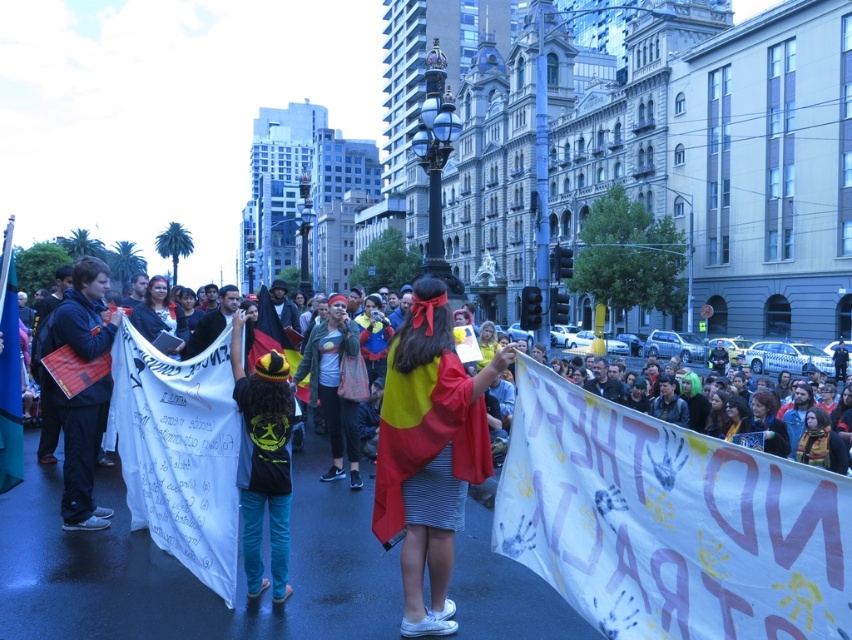
Does black matte t-shirt at center have a greater width compared to dark blue jacket at left?

Incorrect, black matte t-shirt at center's width does not surpass dark blue jacket at left's.

Image resolution: width=852 pixels, height=640 pixels. Identify the location of black matte t-shirt at center. (263, 461).

Which is behind, point (246, 572) or point (83, 504)?

The point (83, 504) is behind.

Identify the location of black matte t-shirt at center. (263, 461).

This screenshot has height=640, width=852. Describe the element at coordinates (82, 452) in the screenshot. I see `dark blue jacket at left` at that location.

Is point (73, 417) positioned before point (320, 337)?

Yes.

Which is in front, point (104, 346) or point (346, 346)?

Point (104, 346) is more forward.

Locate an element on the screen. The height and width of the screenshot is (640, 852). dark blue jacket at left is located at coordinates (82, 452).

Does red/yellow fabric at center appear over black matte t-shirt at center?

No, red/yellow fabric at center is not above black matte t-shirt at center.

Is point (413, 472) closer to camera compared to point (281, 600)?

No, (413, 472) is behind (281, 600).

What do you see at coordinates (429, 452) in the screenshot? This screenshot has width=852, height=640. I see `red/yellow fabric at center` at bounding box center [429, 452].

Identify the location of red/yellow fabric at center. (429, 452).